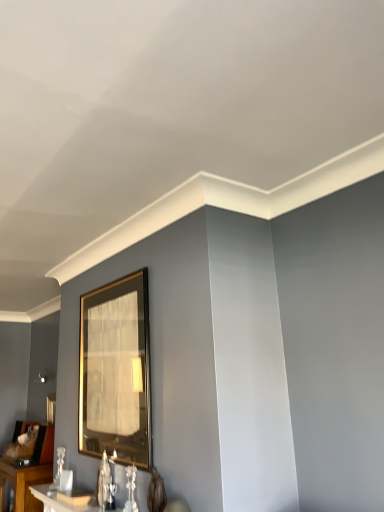
Identify the location of gold-framed mirror at lower left, marked as the first picture frame in a left-to-right arrangement. This screenshot has width=384, height=512. (22, 428).

Describe the element at coordinates (22, 428) in the screenshot. The image size is (384, 512). I see `gold-framed mirror at lower left, marked as the first picture frame in a left-to-right arrangement` at that location.

Describe the element at coordinates (24, 483) in the screenshot. I see `white glossy table at lower left, acting as the second table starting from the right` at that location.

Locate an element on the screen. The width and height of the screenshot is (384, 512). gold metallic picture frame at center, arranged as the first picture frame when viewed from the front is located at coordinates (116, 372).

The image size is (384, 512). In order to click on the 2nd table in front of the gold-framed mirror at lower left, marked as the first picture frame in a left-to-right arrangement in this screenshot , I will do `click(59, 501)`.

From the image's perspective, is white glossy table at lower left, placed as the 2th table when sorted from bottom to top, above or below gold-framed mirror at lower left, which is the first picture frame from back to front?

From the image's perspective, white glossy table at lower left, placed as the 2th table when sorted from bottom to top, appears above gold-framed mirror at lower left, which is the first picture frame from back to front.

From a real-world perspective, is white glossy table at lower left, marked as the 1th table in a top-to-bottom arrangement, located beneath gold-framed mirror at lower left, arranged as the second picture frame when viewed from the right?

Indeed, from a real-world perspective, white glossy table at lower left, marked as the 1th table in a top-to-bottom arrangement, is positioned beneath gold-framed mirror at lower left, arranged as the second picture frame when viewed from the right.

Which is behind, point (26, 432) or point (81, 317)?

The point (26, 432) is behind.

Is gold-framed mirror at lower left, arranged as the second picture frame when viewed from the right, not near gold metallic picture frame at center, which ranks as the first picture frame in top-to-bottom order?

That's right, there is a large distance between gold-framed mirror at lower left, arranged as the second picture frame when viewed from the right, and gold metallic picture frame at center, which ranks as the first picture frame in top-to-bottom order.

Would you say gold-framed mirror at lower left, arranged as the second picture frame when viewed from the right, is outside gold metallic picture frame at center, which ranks as the 1th picture frame in right-to-left order?

Absolutely, gold-framed mirror at lower left, arranged as the second picture frame when viewed from the right, is external to gold metallic picture frame at center, which ranks as the 1th picture frame in right-to-left order.

Does point (110, 419) appear closer or farther from the camera than point (45, 484)?

Clearly, point (110, 419) is closer to the camera than point (45, 484).

In the scene shown: Is gold metallic picture frame at center, the second picture frame in the bottom-to-top sequence, touching white glossy table at lower left, placed as the 2th table when sorted from bottom to top?

No, gold metallic picture frame at center, the second picture frame in the bottom-to-top sequence, is not next to white glossy table at lower left, placed as the 2th table when sorted from bottom to top.

Is gold metallic picture frame at center, which ranks as the 1th picture frame in right-to-left order, completely or partially outside of white glossy table at lower left, the 1th table when ordered from right to left?

Absolutely, gold metallic picture frame at center, which ranks as the 1th picture frame in right-to-left order, is external to white glossy table at lower left, the 1th table when ordered from right to left.

Looking at this image, between gold metallic picture frame at center, which ranks as the 1th picture frame in right-to-left order, and white glossy table at lower left, which is the second table from back to front, which one appears on the right side from the viewer's perspective?

gold metallic picture frame at center, which ranks as the 1th picture frame in right-to-left order, is more to the right.

Choose the correct answer: Is white glossy table at lower left, marked as the 1th table in a top-to-bottom arrangement, inside white glossy table at lower left, marked as the second table in a top-to-bottom arrangement, or outside it?

white glossy table at lower left, marked as the 1th table in a top-to-bottom arrangement, is located beyond the bounds of white glossy table at lower left, marked as the second table in a top-to-bottom arrangement.

Is white glossy table at lower left, marked as the 1th table in a top-to-bottom arrangement, in contact with white glossy table at lower left, the 1th table ordered from the bottom?

white glossy table at lower left, marked as the 1th table in a top-to-bottom arrangement, and white glossy table at lower left, the 1th table ordered from the bottom, are clearly separated.

Does white glossy table at lower left, marked as the 1th table in a top-to-bottom arrangement, come in front of white glossy table at lower left, which is the first table in left-to-right order?

Yes, it is.

Who is smaller, gold metallic picture frame at center, the second picture frame in the bottom-to-top sequence, or gold-framed mirror at lower left, which is the first picture frame from back to front?

gold-framed mirror at lower left, which is the first picture frame from back to front, is smaller.

From a real-world perspective, is gold metallic picture frame at center, which ranks as the 1th picture frame in right-to-left order, physically located above or below gold-framed mirror at lower left, which ranks as the first picture frame in bottom-to-top order?

gold metallic picture frame at center, which ranks as the 1th picture frame in right-to-left order, is situated higher than gold-framed mirror at lower left, which ranks as the first picture frame in bottom-to-top order, in the real world.

Which object is positioned more to the left, gold metallic picture frame at center, which is the second picture frame in back-to-front order, or gold-framed mirror at lower left, arranged as the second picture frame when viewed from the right?

From the viewer's perspective, gold-framed mirror at lower left, arranged as the second picture frame when viewed from the right, appears more on the left side.

Is gold metallic picture frame at center, which is the second picture frame in back-to-front order, with gold-framed mirror at lower left, which is the second picture frame in top-to-bottom order?

No, gold metallic picture frame at center, which is the second picture frame in back-to-front order, is not making contact with gold-framed mirror at lower left, which is the second picture frame in top-to-bottom order.

Can you tell me how much white glossy table at lower left, which is the second table from back to front, and gold metallic picture frame at center, which is the second picture frame in back-to-front order, differ in facing direction?

0.116 degrees.

From a real-world perspective, is white glossy table at lower left, which is the second table from back to front, on top of gold metallic picture frame at center, which ranks as the 1th picture frame in right-to-left order?

Incorrect, from a real-world perspective, white glossy table at lower left, which is the second table from back to front, is lower than gold metallic picture frame at center, which ranks as the 1th picture frame in right-to-left order.

From the image's perspective, which is below, white glossy table at lower left, the 1th table when ordered from right to left, or gold metallic picture frame at center, arranged as the first picture frame when viewed from the front?

white glossy table at lower left, the 1th table when ordered from right to left, is shown below in the image.

Which is correct: white glossy table at lower left, the second table from the left, is inside gold metallic picture frame at center, which is the second picture frame in back-to-front order, or outside of it?

white glossy table at lower left, the second table from the left, is outside gold metallic picture frame at center, which is the second picture frame in back-to-front order.

Consider the image. From a real-world perspective, which is physically below, gold-framed mirror at lower left, which ranks as the first picture frame in bottom-to-top order, or white glossy table at lower left, the 1th table ordered from the bottom?

In real-world perspective, white glossy table at lower left, the 1th table ordered from the bottom, is lower.

Considering the positions of objects gold-framed mirror at lower left, the 2th picture frame when ordered from front to back, and white glossy table at lower left, acting as the second table starting from the right, in the image provided, who is more to the right, gold-framed mirror at lower left, the 2th picture frame when ordered from front to back, or white glossy table at lower left, acting as the second table starting from the right,?

white glossy table at lower left, acting as the second table starting from the right, is more to the right.

Is gold-framed mirror at lower left, marked as the first picture frame in a left-to-right arrangement, in contact with white glossy table at lower left, which is the first table in left-to-right order?

No, gold-framed mirror at lower left, marked as the first picture frame in a left-to-right arrangement, is not beside white glossy table at lower left, which is the first table in left-to-right order.

Which of these two, gold-framed mirror at lower left, marked as the first picture frame in a left-to-right arrangement, or white glossy table at lower left, which is the first table in left-to-right order, is bigger?

Bigger between the two is white glossy table at lower left, which is the first table in left-to-right order.

This screenshot has height=512, width=384. I want to click on table above the gold-framed mirror at lower left, which is the second picture frame in top-to-bottom order (from the image's perspective), so click(59, 501).

Locate an element on the screen. picture frame that appears behind the gold metallic picture frame at center, the second picture frame in the bottom-to-top sequence is located at coordinates (22, 428).

Considering their positions, is gold-framed mirror at lower left, marked as the first picture frame in a left-to-right arrangement, positioned further to white glossy table at lower left, which is the second table from back to front, than white glossy table at lower left, which is the first table in left-to-right order?

Based on the image, gold-framed mirror at lower left, marked as the first picture frame in a left-to-right arrangement, appears to be further to white glossy table at lower left, which is the second table from back to front.

Which object lies nearer to the anchor point gold metallic picture frame at center, which is the second picture frame in back-to-front order, gold-framed mirror at lower left, marked as the first picture frame in a left-to-right arrangement, or white glossy table at lower left, the 1th table in the front-to-back sequence?

white glossy table at lower left, the 1th table in the front-to-back sequence.

Looking at the image, which one is located further to gold-framed mirror at lower left, which ranks as the first picture frame in bottom-to-top order, white glossy table at lower left, marked as the second table in a top-to-bottom arrangement, or gold metallic picture frame at center, the 2th picture frame when ordered from left to right?

Based on the image, gold metallic picture frame at center, the 2th picture frame when ordered from left to right, appears to be further to gold-framed mirror at lower left, which ranks as the first picture frame in bottom-to-top order.

Looking at the image, which one is located closer to white glossy table at lower left, acting as the second table starting from the right, gold-framed mirror at lower left, which is the second picture frame in top-to-bottom order, or gold metallic picture frame at center, which is the second picture frame in back-to-front order?

Among the two, gold-framed mirror at lower left, which is the second picture frame in top-to-bottom order, is located nearer to white glossy table at lower left, acting as the second table starting from the right.

Which object lies nearer to the anchor point gold-framed mirror at lower left, marked as the first picture frame in a left-to-right arrangement, white glossy table at lower left, which is the second table from back to front, or gold metallic picture frame at center, which ranks as the 1th picture frame in right-to-left order?

Based on the image, white glossy table at lower left, which is the second table from back to front, appears to be nearer to gold-framed mirror at lower left, marked as the first picture frame in a left-to-right arrangement.

When comparing their distances from gold-framed mirror at lower left, the 2th picture frame when ordered from front to back, does gold metallic picture frame at center, which ranks as the first picture frame in top-to-bottom order, or white glossy table at lower left, the first table when ordered from back to front, seem closer?

Among the two, white glossy table at lower left, the first table when ordered from back to front, is located nearer to gold-framed mirror at lower left, the 2th picture frame when ordered from front to back.

Estimate the real-world distances between objects in this image. Which object is further from white glossy table at lower left, placed as the 2th table when sorted from bottom to top, gold metallic picture frame at center, which ranks as the 1th picture frame in right-to-left order, or white glossy table at lower left, marked as the second table in a top-to-bottom arrangement?

white glossy table at lower left, marked as the second table in a top-to-bottom arrangement, is further to white glossy table at lower left, placed as the 2th table when sorted from bottom to top.

Based on their spatial positions, is white glossy table at lower left, acting as the second table starting from the right, or white glossy table at lower left, the second table from the left, further from gold-framed mirror at lower left, which ranks as the first picture frame in bottom-to-top order?

white glossy table at lower left, the second table from the left, lies further to gold-framed mirror at lower left, which ranks as the first picture frame in bottom-to-top order, than the other object.

I want to click on table between gold metallic picture frame at center, which ranks as the first picture frame in top-to-bottom order, and gold-framed mirror at lower left, which is the second picture frame in top-to-bottom order, along the z-axis, so click(24, 483).

At what (x,y) coordinates should I click in order to perform the action: click on table between white glossy table at lower left, the second table from the left, and gold-framed mirror at lower left, which ranks as the first picture frame in bottom-to-top order, from front to back. Please return your answer as a coordinate pair (x, y). Image resolution: width=384 pixels, height=512 pixels. Looking at the image, I should click on (24, 483).

Identify the location of table between gold metallic picture frame at center, the second picture frame in the bottom-to-top sequence, and white glossy table at lower left, which is the first table in left-to-right order, in the up-down direction. This screenshot has width=384, height=512. (59, 501).

Identify the location of picture frame located between white glossy table at lower left, placed as the 2th table when sorted from bottom to top, and gold-framed mirror at lower left, which ranks as the first picture frame in bottom-to-top order, in the depth direction. (116, 372).